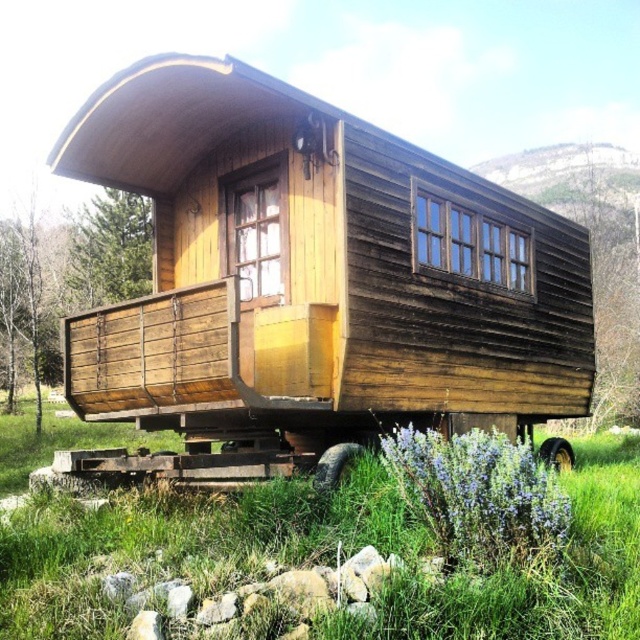
Which is above, weathered wood hut at center or dark brown rubber wheel at lower right?

weathered wood hut at center is higher up.

Who is more forward, (x=586, y=358) or (x=332, y=465)?

Point (x=332, y=465) is in front.

Which is behind, point (589, 353) or point (333, 468)?

The point (589, 353) is more distant.

I want to click on weathered wood hut at center, so click(310, 282).

Is weathered wood hut at center below brown rubber wheel at lower right?

Actually, weathered wood hut at center is above brown rubber wheel at lower right.

Does point (333, 412) come farther from viewer compared to point (566, 470)?

No.

You are a GUI agent. You are given a task and a screenshot of the screen. Output one action in this format:
    pyautogui.click(x=<x>, y=<y>)
    Task: Click on the weathered wood hut at center
    Image resolution: width=640 pixels, height=640 pixels.
    Given the screenshot: What is the action you would take?
    pyautogui.click(x=310, y=282)

Identify the location of dark brown rubber wheel at lower right. The width and height of the screenshot is (640, 640). (333, 465).

Identify the location of dark brown rubber wheel at lower right. (333, 465).

At what (x,y) coordinates should I click in order to perform the action: click on dark brown rubber wheel at lower right. Please return your answer as a coordinate pair (x, y). Looking at the image, I should click on (333, 465).